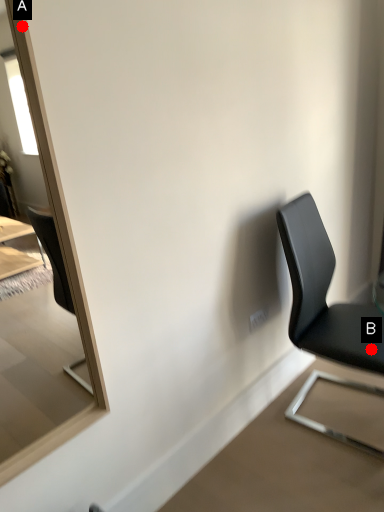
Question: Two points are circled on the image, labeled by A and B beside each circle. Which point appears farthest from the camera in this image?

Choices:
 (A) A is further
 (B) B is further

Answer: (B)